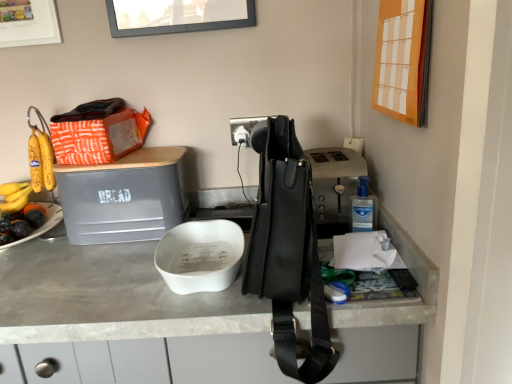
Question: Does black plastic power outlet at center appear on the right side of white matte bowl at center?

Choices:
 (A) no
 (B) yes

Answer: (B)

Question: Considering the relative sizes of black plastic power outlet at center and white matte bowl at center in the image provided, is black plastic power outlet at center bigger than white matte bowl at center?

Choices:
 (A) yes
 (B) no

Answer: (B)

Question: Does black plastic power outlet at center have a smaller size compared to white matte bowl at center?

Choices:
 (A) yes
 (B) no

Answer: (A)

Question: Is black plastic power outlet at center far away from white matte bowl at center?

Choices:
 (A) yes
 (B) no

Answer: (B)

Question: From a real-world perspective, is black plastic power outlet at center located higher than white matte bowl at center?

Choices:
 (A) yes
 (B) no

Answer: (A)

Question: Is black plastic power outlet at center facing towards white matte bowl at center?

Choices:
 (A) no
 (B) yes

Answer: (A)

Question: Does gray matte bread bin at upper left have a lesser height compared to matte white picture frame at upper left, which ranks as the second picture frame in bottom-to-top order?

Choices:
 (A) yes
 (B) no

Answer: (A)

Question: Does gray matte bread bin at upper left have a lesser width compared to matte white picture frame at upper left, which is counted as the first picture frame, starting from the back?

Choices:
 (A) yes
 (B) no

Answer: (B)

Question: Does gray matte bread bin at upper left have a greater height compared to matte white picture frame at upper left, which is counted as the first picture frame, starting from the back?

Choices:
 (A) no
 (B) yes

Answer: (A)

Question: Does gray matte bread bin at upper left turn towards matte white picture frame at upper left, the 2th picture frame when ordered from right to left?

Choices:
 (A) no
 (B) yes

Answer: (A)

Question: From the image's perspective, does gray matte bread bin at upper left appear lower than matte white picture frame at upper left, which is counted as the first picture frame, starting from the back?

Choices:
 (A) yes
 (B) no

Answer: (A)

Question: From a real-world perspective, is gray matte bread bin at upper left physically above matte white picture frame at upper left, the 2th picture frame in the front-to-back sequence?

Choices:
 (A) no
 (B) yes

Answer: (A)

Question: Considering the relative sizes of white matte bowl at center and black plastic power outlet at center in the image provided, is white matte bowl at center smaller than black plastic power outlet at center?

Choices:
 (A) yes
 (B) no

Answer: (B)